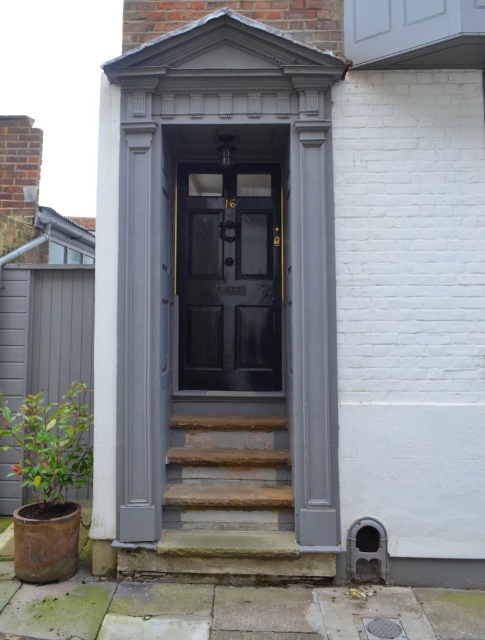
You are a delivery person with a package that requires a 1.2 meter clearance to maneuver around obstacles. You are standing near the green leafy plant at lower left and need to reach the matte black door at center. Can you navigate to the door without needing to adjust your path?

The matte black door at center is 1.18 meters from the green leafy plant at lower left. Since the required clearance is 1.2 meters and the distance is slightly less, you will need to adjust your path to ensure there is enough space.

You are standing in front of the building and looking at the doorway. There are two points marked on the image. One is at coordinate point (217, 529) and the other is at point (71, 474). Which point is closer to you?

→ Point (71, 474) is closer to you because it is less further to the camera than point (217, 529).

You are standing at the base of the natural stone stairs at center and want to enter the matte black door at center. Which direction should you move to reach the door?

Since the natural stone stairs at center is behind the matte black door at center, you should move forward towards the matte black door at center to reach it.